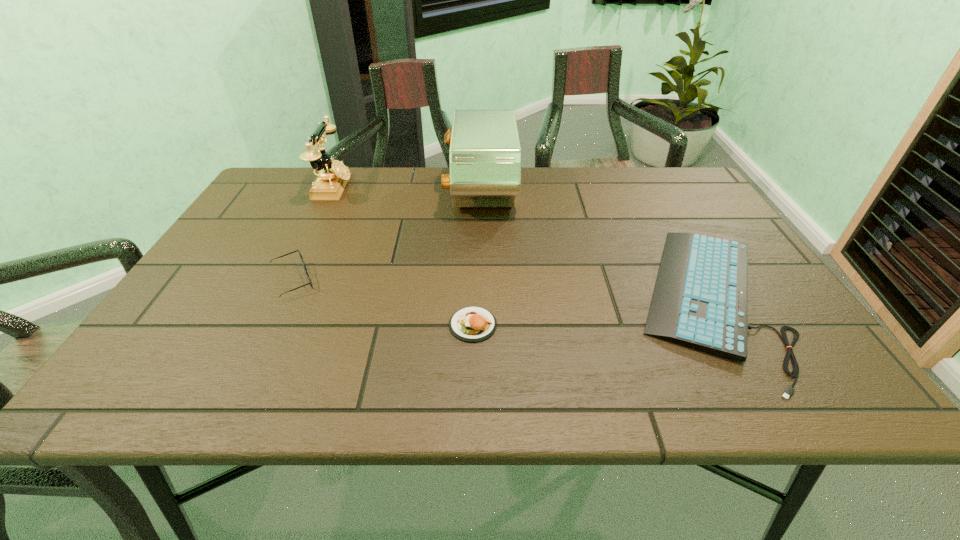
Locate an element on the screen. vacant area that lies between the toaster oven and the third tallest object is located at coordinates (387, 237).

Image resolution: width=960 pixels, height=540 pixels. I want to click on free space between the toaster oven and the spectacles, so click(x=387, y=237).

Locate an element on the screen. empty location between the shortest object and the patty (food) is located at coordinates (589, 313).

Where is `vacant area that lies between the toaster oven and the patty (food)`? The image size is (960, 540). vacant area that lies between the toaster oven and the patty (food) is located at coordinates (477, 258).

Where is `vacant region between the third tallest object and the shortest object`? vacant region between the third tallest object and the shortest object is located at coordinates 499,291.

At what (x,y) coordinates should I click in order to perform the action: click on the closest object to the telephone. Please return your answer as a coordinate pair (x, y). The height and width of the screenshot is (540, 960). Looking at the image, I should click on (300, 255).

Select which object appears as the closest to the telephone. Please provide its 2D coordinates. Your answer should be formatted as a tuple, i.e. [(x, y)], where the tuple contains the x and y coordinates of a point satisfying the conditions above.

[(300, 255)]

The width and height of the screenshot is (960, 540). What are the coordinates of `vacant space that satisfies the following two spatial constraints: 1. with the lenses facing outward on the third tallest object; 2. on the left side of the patty (food)` in the screenshot? It's located at (271, 325).

Find the location of a particular element. vacant region that satisfies the following two spatial constraints: 1. with the lenses facing outward on the computer keyboard; 2. on the right side of the third shortest object is located at coordinates (283, 300).

Locate an element on the screen. vacant point that satisfies the following two spatial constraints: 1. with the lenses facing outward on the patty (food); 2. on the left side of the third shortest object is located at coordinates (271, 325).